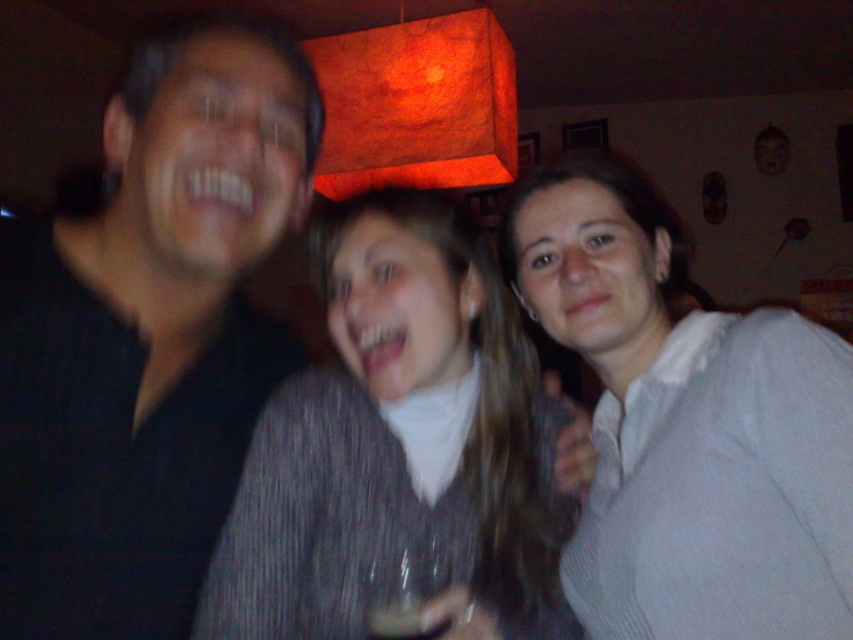
You are a photographer at a party and want to take a photo of the black matte shirt at left and the translucent glass wine at center. Since the lampshade is casting a warm light, which object will be illuminated more by the light from the lampshade?

The black matte shirt at left will be illuminated more by the light from the lampshade because it is positioned closer to the lampshade than the translucent glass wine at center.

Looking at this image, you are taking a photo of two points in a dimly lit room with a warm lamp. The points are labeled as point (566,221) and point (409,568). Which point is closer to the camera?

Point (566,221) is further to the camera than point (409,568), so point (409,568) is closer to the camera.

You are standing in the room and want to locate the striped sweater at center. According to the coordinates provided, where should you look relative to the lampshade?

The striped sweater at center is located at coordinates point (398, 442), which is to the lower right of the lampshade.